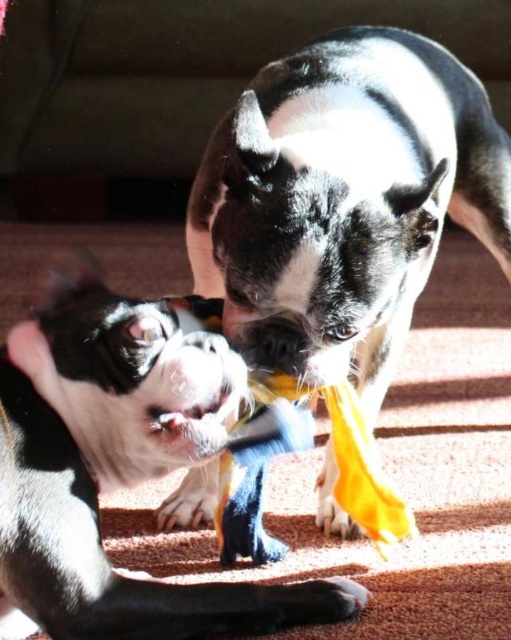
Question: Is black matte dog at center positioned at the back of fuzzy white fur at center?

Choices:
 (A) yes
 (B) no

Answer: (B)

Question: Which object is farther from the camera taking this photo?

Choices:
 (A) fuzzy white fur at center
 (B) black and white fur at center
 (C) black matte dog at center

Answer: (A)

Question: From the image, what is the correct spatial relationship of black and white fur at center in relation to black matte dog at center?

Choices:
 (A) left
 (B) right

Answer: (B)

Question: Is black and white fur at center behind black matte dog at center?

Choices:
 (A) no
 (B) yes

Answer: (B)

Question: Which point is closer to the camera?

Choices:
 (A) (51, 458)
 (B) (229, 387)
 (C) (346, 298)

Answer: (A)

Question: Which point is closer to the camera taking this photo?

Choices:
 (A) (214, 413)
 (B) (313, 621)

Answer: (A)